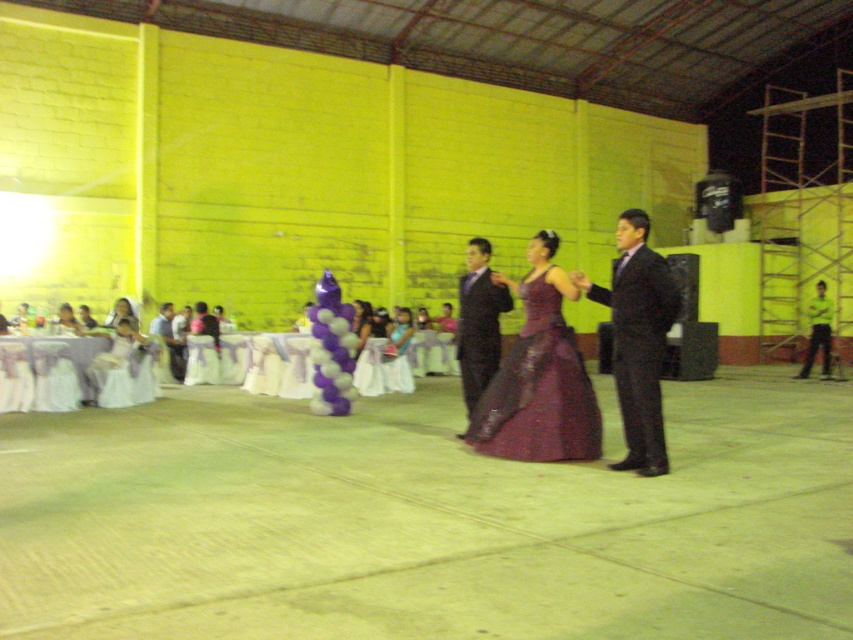
You are standing at the point marked by the coordinates point (x=817, y=332). What object are you currently standing on?

You are standing on the green fabric pants at center.

You are a photographer at the event and want to capture both the green fabric pants at center and the satin purple dress at center in a single photo. However, the camera can only focus on one subject at a time. Which subject should you focus on to ensure the other remains in the background?

You should focus on the green fabric pants at center because the satin purple dress at center is behind it, so focusing on the front subject will keep the background in focus.

Based on the scene description, can you determine the relative positions of the matte black suit at center and the matte white dress at lower left? Specifically, which one is positioned to the right of the other?

The matte black suit at center is to the right of the matte white dress at lower left.